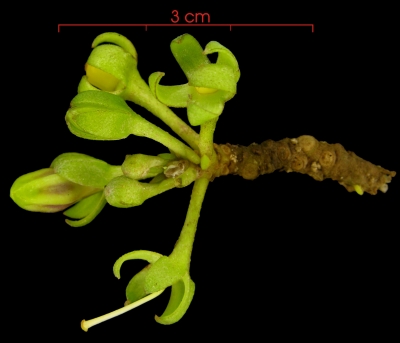
At what (x,y) coordinates should I click in order to perform the action: click on yellow bulb. Please return your answer as a coordinate pair (x, y). This screenshot has height=343, width=400. Looking at the image, I should click on (97, 77), (203, 88).